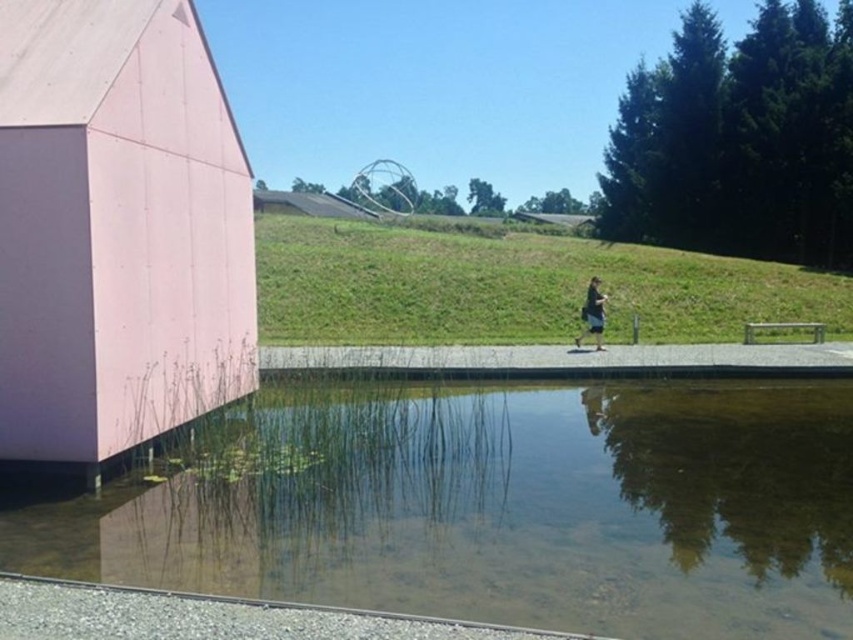
Question: Is matte pink wall at left to the left of black fabric at center from the viewer's perspective?

Choices:
 (A) yes
 (B) no

Answer: (A)

Question: Estimate the real-world distances between objects in this image. Which object is closer to the matte pink wall at left?

Choices:
 (A) clear glass water at lower center
 (B) black fabric at center

Answer: (A)

Question: From the image, what is the correct spatial relationship of clear glass water at lower center in relation to matte pink wall at left?

Choices:
 (A) above
 (B) below

Answer: (B)

Question: Estimate the real-world distances between objects in this image. Which object is farther from the clear glass water at lower center?

Choices:
 (A) matte pink wall at left
 (B) black fabric at center

Answer: (B)

Question: Among these objects, which one is nearest to the camera?

Choices:
 (A) matte pink wall at left
 (B) clear glass water at lower center

Answer: (B)

Question: Is matte pink wall at left above black fabric at center?

Choices:
 (A) yes
 (B) no

Answer: (A)